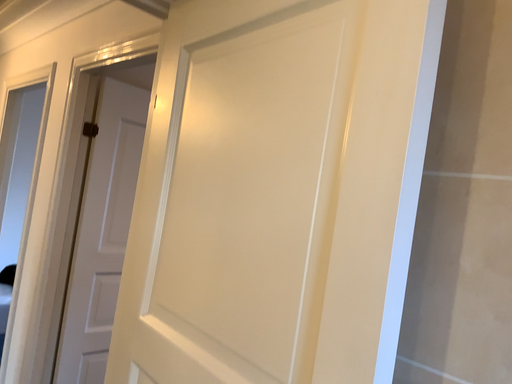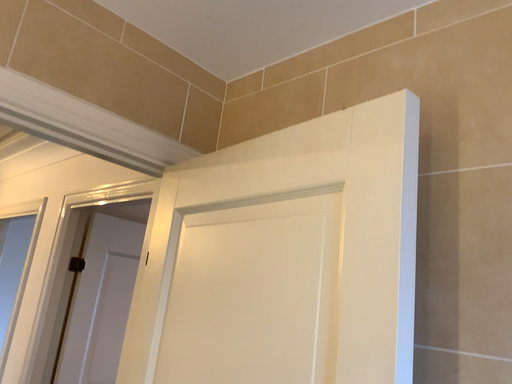
Question: Which way did the camera rotate in the video?

Choices:
 (A) rotated downward
 (B) rotated upward

Answer: (B)